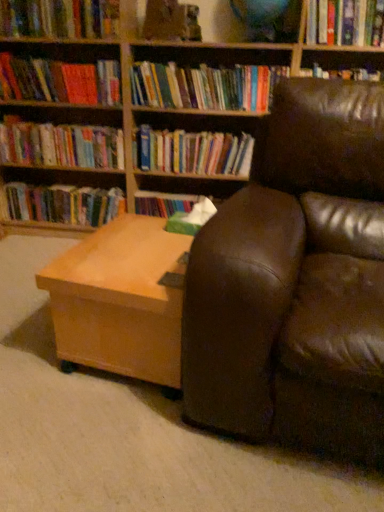
Question: Can you confirm if brown leather couch at right is wider than hardcover book at upper left, arranged as the 3th book when viewed from the top?

Choices:
 (A) yes
 (B) no

Answer: (A)

Question: From a real-world perspective, is brown leather couch at right under hardcover book at upper left, arranged as the 3th book when viewed from the top?

Choices:
 (A) no
 (B) yes

Answer: (B)

Question: Does brown leather couch at right have a lesser width compared to hardcover book at upper left, arranged as the sixth book when ordered from the bottom?

Choices:
 (A) yes
 (B) no

Answer: (B)

Question: Considering the relative sizes of brown leather couch at right and hardcover book at upper left, arranged as the sixth book when ordered from the bottom, in the image provided, is brown leather couch at right smaller than hardcover book at upper left, arranged as the sixth book when ordered from the bottom,?

Choices:
 (A) yes
 (B) no

Answer: (B)

Question: Considering the relative positions of brown leather couch at right and hardcover book at upper left, arranged as the sixth book when ordered from the bottom, in the image provided, is brown leather couch at right in front of hardcover book at upper left, arranged as the sixth book when ordered from the bottom,?

Choices:
 (A) no
 (B) yes

Answer: (B)

Question: Is hardcover book at upper right, which is the 7th book in bottom-to-top order, wider or thinner than hardcover books at left, which appears as the 8th book when viewed from the top?

Choices:
 (A) thin
 (B) wide

Answer: (B)

Question: Is hardcover book at upper right, which is the 7th book in bottom-to-top order, bigger or smaller than hardcover books at left, which appears as the 8th book when viewed from the top?

Choices:
 (A) small
 (B) big

Answer: (A)

Question: Is point (342, 4) positioned closer to the camera than point (115, 201)?

Choices:
 (A) farther
 (B) closer

Answer: (B)

Question: From the image's perspective, relative to hardcover books at left, which appears as the 8th book when viewed from the top, is hardcover book at upper right, arranged as the 2th book when viewed from the top, above or below?

Choices:
 (A) below
 (B) above

Answer: (B)

Question: From a real-world perspective, relative to hardcover books at center, which is counted as the second book, starting from the bottom, is hardcover book at upper left, arranged as the sixth book when ordered from the bottom, vertically above or below?

Choices:
 (A) below
 (B) above

Answer: (B)

Question: Is point pyautogui.click(x=117, y=89) closer or farther from the camera than point pyautogui.click(x=162, y=137)?

Choices:
 (A) closer
 (B) farther

Answer: (A)

Question: Is hardcover book at upper left, arranged as the sixth book when ordered from the bottom, spatially inside hardcover books at center, arranged as the seventh book when viewed from the top, or outside of it?

Choices:
 (A) outside
 (B) inside

Answer: (A)

Question: Visually, is hardcover book at upper left, arranged as the 3th book when viewed from the top, positioned to the left or to the right of hardcover books at center, arranged as the seventh book when viewed from the top?

Choices:
 (A) right
 (B) left

Answer: (B)

Question: Is hardcover book at upper center, which is counted as the fourth book, starting from the bottom, wider or thinner than hardcover books at left, which appears as the 3th book when ordered from the bottom?

Choices:
 (A) wide
 (B) thin

Answer: (A)

Question: Relative to hardcover books at left, which appears as the 3th book when ordered from the bottom, is hardcover book at upper center, which is counted as the fourth book, starting from the bottom, in front or behind?

Choices:
 (A) behind
 (B) front

Answer: (B)